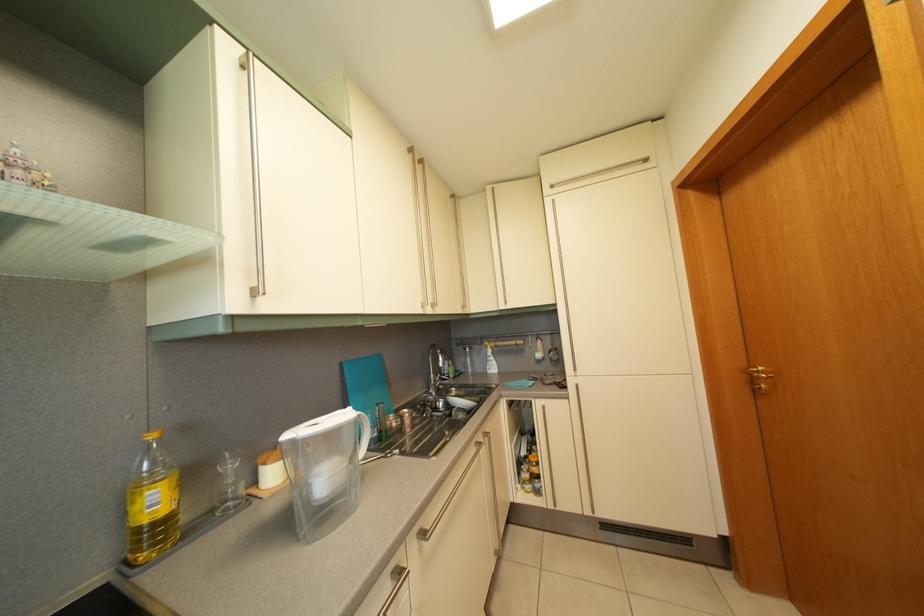
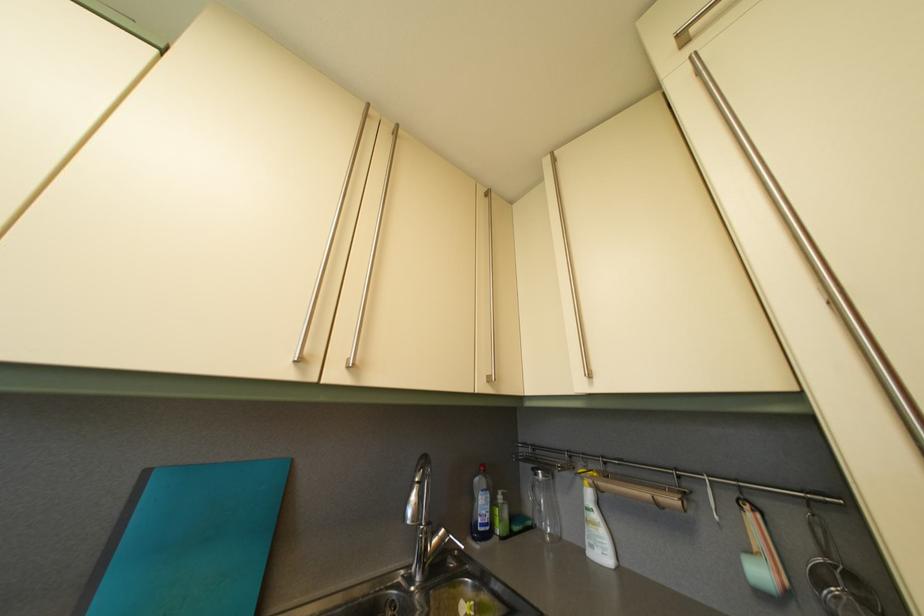
The point at (496, 197) is marked in the first image. Where is the corresponding point in the second image?

(554, 169)